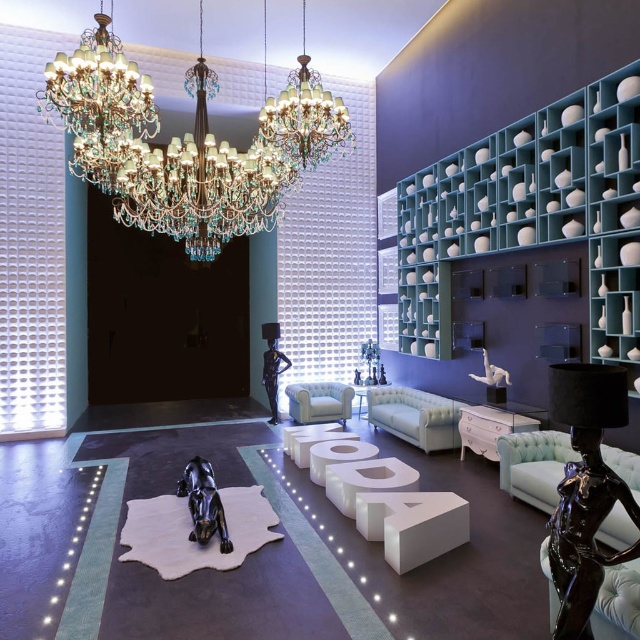
You are a delivery person carrying a large package that is 30 inches wide. You need to move through the space between the teal fabric couch at lower right and the white glossy dresser at lower right. Can you fit through this space with your package?

The distance between the teal fabric couch at lower right and the white glossy dresser at lower right is 27.30 inches. Since the package is 30 inches wide, it is wider than the available space. Therefore, you cannot fit through the space with the package.

You are a customer in this showroom and want to sit down. There is a white leather couch at center and a white glossy sculpture at center. Which one is bigger and more suitable for sitting?

The white leather couch at center is larger in size than the white glossy sculpture at center, so it is more suitable for sitting.